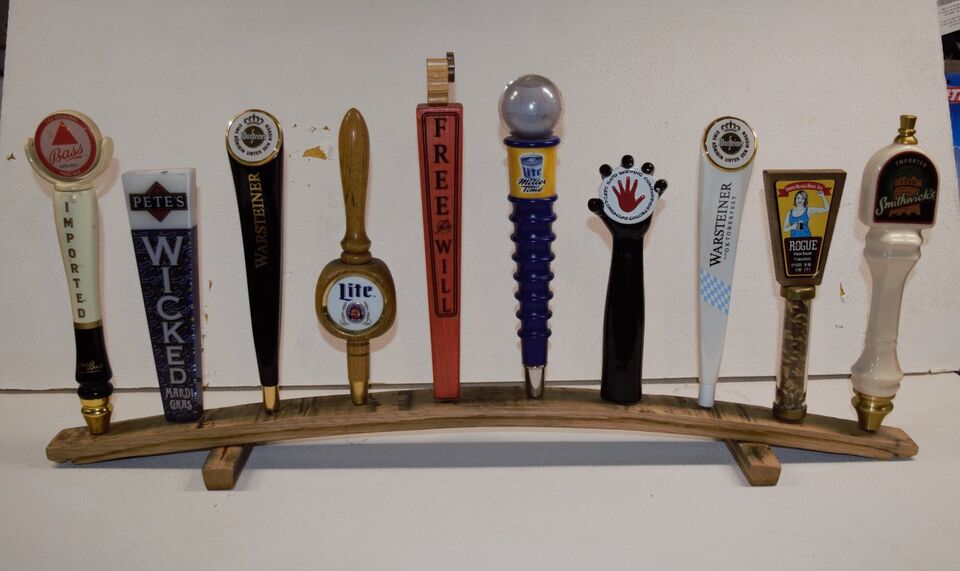
You are a GUI agent. You are given a task and a screenshot of the screen. Output one action in this format:
    pyautogui.click(x=<x>, y=<y>)
    Task: Click on the beer tap handles
    The width and height of the screenshot is (960, 571).
    Given the screenshot: What is the action you would take?
    pyautogui.click(x=83, y=213), pyautogui.click(x=148, y=230), pyautogui.click(x=248, y=219), pyautogui.click(x=347, y=213), pyautogui.click(x=428, y=195), pyautogui.click(x=522, y=207), pyautogui.click(x=612, y=219), pyautogui.click(x=722, y=216), pyautogui.click(x=792, y=226), pyautogui.click(x=883, y=217)